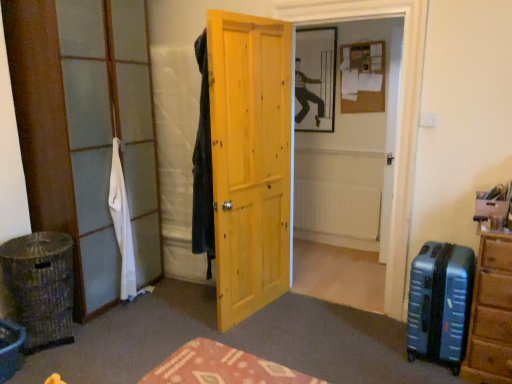
Question: Is white fabric at left closer to camera compared to clear glass door at left?

Choices:
 (A) no
 (B) yes

Answer: (A)

Question: Would you say white fabric at left is a long distance from clear glass door at left?

Choices:
 (A) no
 (B) yes

Answer: (A)

Question: Is white fabric at left thinner than clear glass door at left?

Choices:
 (A) no
 (B) yes

Answer: (B)

Question: From a real-world perspective, is white fabric at left under clear glass door at left?

Choices:
 (A) no
 (B) yes

Answer: (B)

Question: Considering the relative sizes of white fabric at left and clear glass door at left in the image provided, is white fabric at left wider than clear glass door at left?

Choices:
 (A) yes
 (B) no

Answer: (B)

Question: In terms of width, does yellow wood door at center look wider or thinner when compared to white matte radiator at center?

Choices:
 (A) wide
 (B) thin

Answer: (A)

Question: Considering the relative positions of yellow wood door at center and white matte radiator at center in the image provided, is yellow wood door at center to the left or to the right of white matte radiator at center?

Choices:
 (A) left
 (B) right

Answer: (A)

Question: From a real-world perspective, is yellow wood door at center physically located above or below white matte radiator at center?

Choices:
 (A) above
 (B) below

Answer: (A)

Question: Based on their sizes in the image, would you say yellow wood door at center is bigger or smaller than white matte radiator at center?

Choices:
 (A) big
 (B) small

Answer: (A)

Question: From the image's perspective, is blue hardshell suitcase at right positioned above or below white fabric at left?

Choices:
 (A) below
 (B) above

Answer: (A)

Question: In terms of height, does blue hardshell suitcase at right look taller or shorter compared to white fabric at left?

Choices:
 (A) tall
 (B) short

Answer: (B)

Question: In the image, is blue hardshell suitcase at right positioned in front of or behind white fabric at left?

Choices:
 (A) front
 (B) behind

Answer: (A)

Question: Is blue hardshell suitcase at right wider or thinner than white fabric at left?

Choices:
 (A) thin
 (B) wide

Answer: (B)

Question: Is point tap(79, 71) closer or farther from the camera than point tap(317, 183)?

Choices:
 (A) closer
 (B) farther

Answer: (A)

Question: Is clear glass door at left wider or thinner than white matte radiator at center?

Choices:
 (A) wide
 (B) thin

Answer: (A)